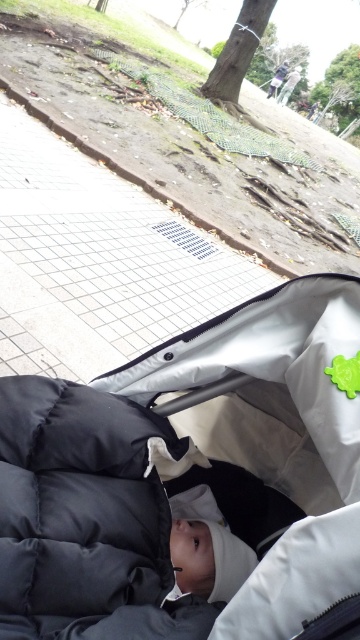
Question: Estimate the real-world distances between objects in this image. Which object is farther from the black puffy sleeping bag at center?

Choices:
 (A) white tile pavement at center
 (B) dark gray quilted fabric baby carriage at center

Answer: (A)

Question: Which object is positioned closest to the black puffy sleeping bag at center?

Choices:
 (A) dark gray quilted fabric baby carriage at center
 (B) white tile pavement at center

Answer: (A)

Question: Can you confirm if black puffy sleeping bag at center is smaller than white tile pavement at center?

Choices:
 (A) yes
 (B) no

Answer: (A)

Question: Which of the following is the farthest from the observer?

Choices:
 (A) (160, 340)
 (B) (124, 490)
 (C) (277, 612)

Answer: (A)

Question: Is dark gray quilted fabric baby carriage at center smaller than black puffy sleeping bag at center?

Choices:
 (A) yes
 (B) no

Answer: (B)

Question: Is black puffy sleeping bag at center thinner than white tile pavement at center?

Choices:
 (A) no
 (B) yes

Answer: (B)